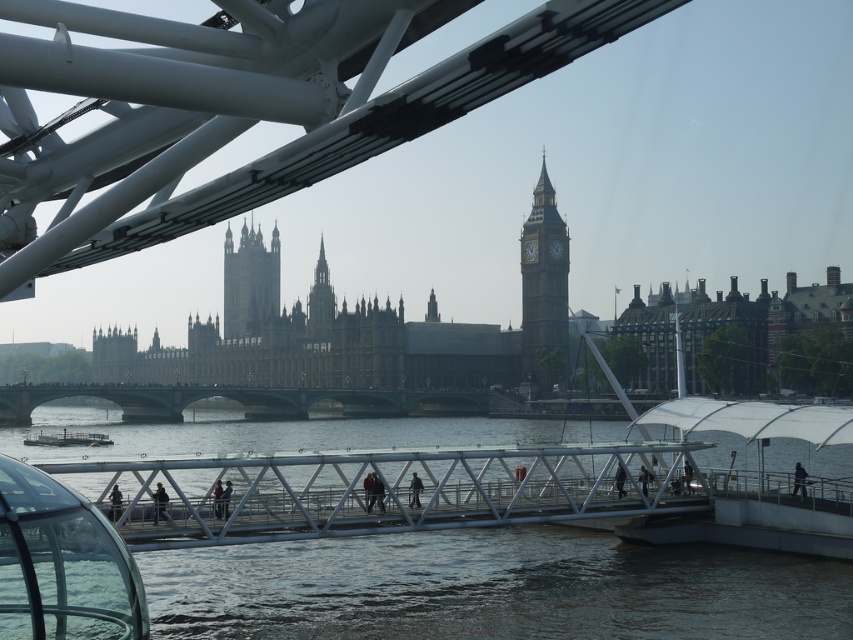
Question: Considering the relative positions of golden stone clock tower at center and dark brown stone tower at center in the image provided, where is golden stone clock tower at center located with respect to dark brown stone tower at center?

Choices:
 (A) above
 (B) below

Answer: (B)

Question: Which is nearer to the golden stone clock tower at center?

Choices:
 (A) brown stone tower at center
 (B) white plastic boat at lower left
 (C) dark brown stone tower at center

Answer: (A)

Question: Among these points, which one is farthest from the camera?

Choices:
 (A) (28, 442)
 (B) (541, 262)

Answer: (B)

Question: Estimate the real-world distances between objects in this image. Which object is closer to the brown stone tower at center?

Choices:
 (A) golden stone clock tower at center
 (B) dark brown stone tower at center

Answer: (A)

Question: Does dark brown stone tower at center appear on the right side of brown stone tower at center?

Choices:
 (A) yes
 (B) no

Answer: (B)

Question: Does golden stone clock tower at center have a lesser width compared to white plastic boat at lower left?

Choices:
 (A) yes
 (B) no

Answer: (A)